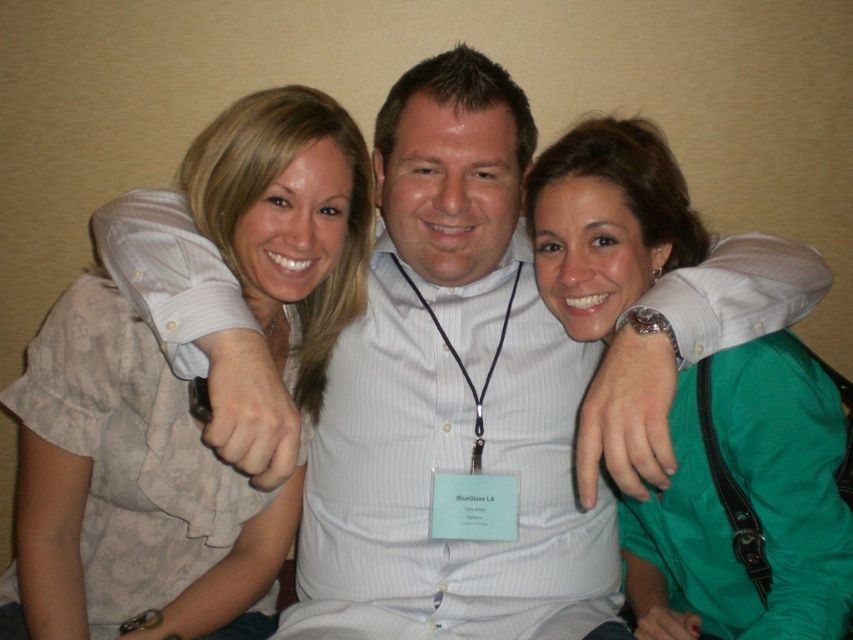
Identify the location of light beige blouse at center. Image resolution: width=853 pixels, height=640 pixels. (128, 492).

Who is taller, light beige blouse at center or green satin blouse at center?

With more height is light beige blouse at center.

Which is behind, point (370, 184) or point (656, 221)?

The point (370, 184) is more distant.

You are a GUI agent. You are given a task and a screenshot of the screen. Output one action in this format:
    pyautogui.click(x=<x>, y=<y>)
    Task: Click on the light beige blouse at center
    This screenshot has width=853, height=640.
    Given the screenshot: What is the action you would take?
    pyautogui.click(x=128, y=492)

Is point (476, 204) less distant than point (688, 228)?

That is True.

Which of these two, white striped shirt at center or green satin blouse at center, stands shorter?

green satin blouse at center is shorter.

Describe the element at coordinates (450, 396) in the screenshot. I see `white striped shirt at center` at that location.

The width and height of the screenshot is (853, 640). Identify the location of white striped shirt at center. (450, 396).

Who is higher up, white striped shirt at center or light beige blouse at center?

white striped shirt at center is higher up.

Who is more forward, (428, 234) or (320, 147)?

Point (320, 147) is in front.

Measure the distance between white striped shirt at center and camera.

white striped shirt at center is 3.71 feet from camera.

This screenshot has width=853, height=640. What are the coordinates of `white striped shirt at center` in the screenshot? It's located at (450, 396).